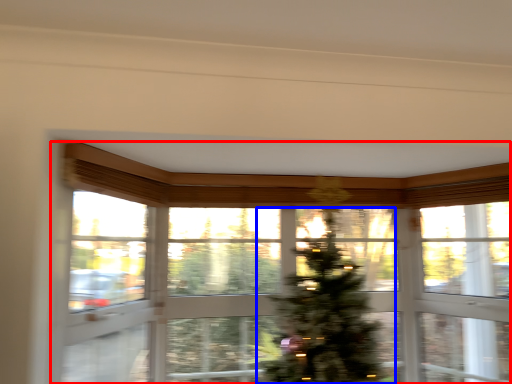
Question: Which point is closer to the camera, window (highlighted by a red box) or christmas tree (highlighted by a blue box)?

Choices:
 (A) window
 (B) christmas tree

Answer: (A)